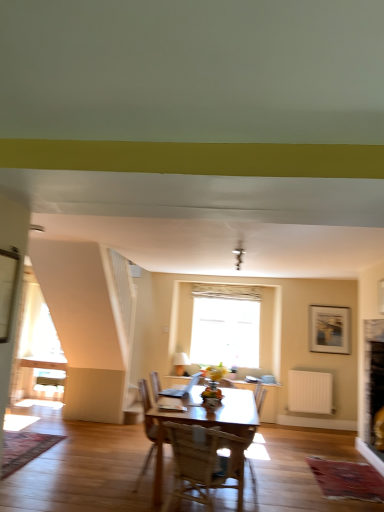
Question: Is point (178, 361) closer or farther from the camera than point (314, 399)?

Choices:
 (A) closer
 (B) farther

Answer: (B)

Question: Considering the relative positions of white fabric lampshade at upper center and white plastic radiator at lower right in the image provided, is white fabric lampshade at upper center to the left or to the right of white plastic radiator at lower right?

Choices:
 (A) left
 (B) right

Answer: (A)

Question: Which object is the closest to the white fabric lampshade at upper center?

Choices:
 (A) wooden framed picture at upper right
 (B) white plastic radiator at lower right
 (C) white textured window at center
 (D) wooden chair at center

Answer: (C)

Question: Which object is the closest to the wooden chair at center?

Choices:
 (A) white fabric lampshade at upper center
 (B) white textured window at center
 (C) wooden framed picture at upper right
 (D) white plastic radiator at lower right

Answer: (D)